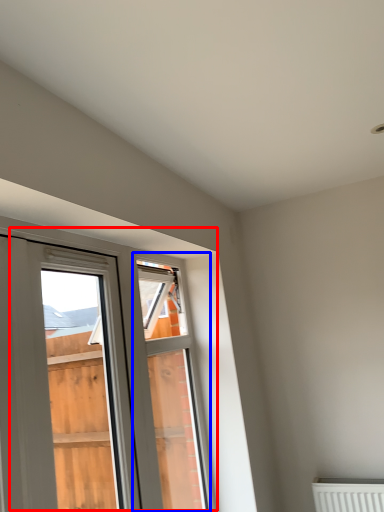
Question: Which of the following is the farthest to the observer, window (highlighted by a red box) or window frame (highlighted by a blue box)?

Choices:
 (A) window
 (B) window frame

Answer: (B)